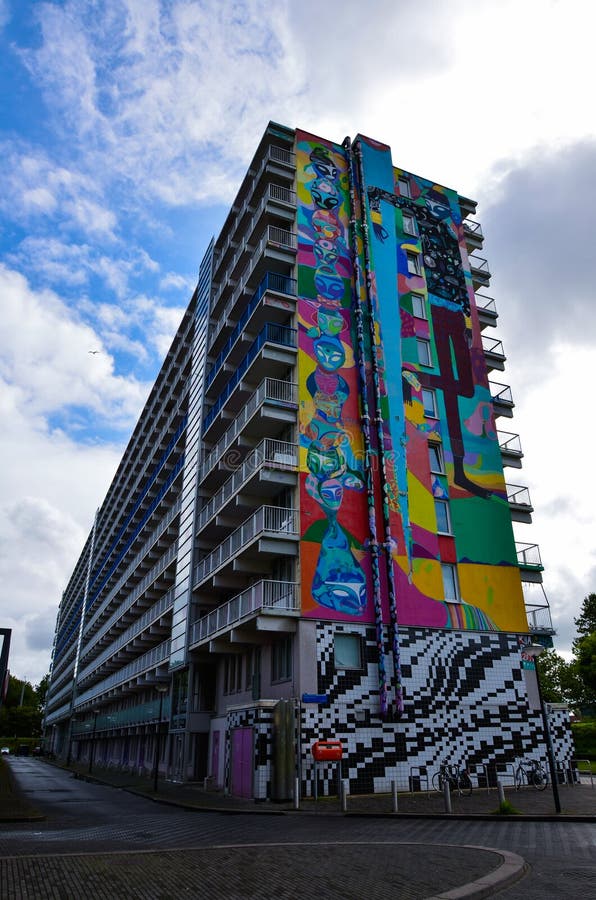
Locate an element on the screen. plant is located at coordinates (483, 808).